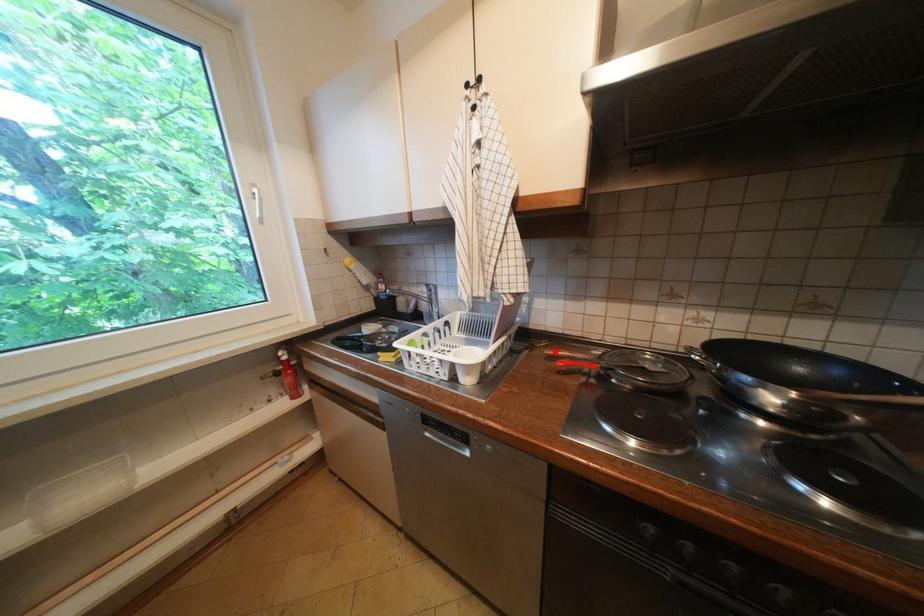
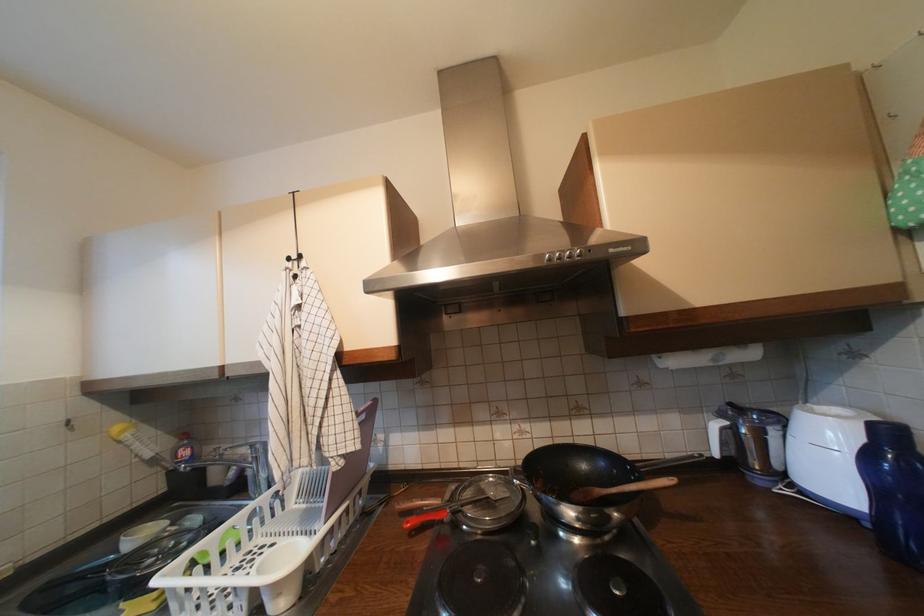
The point at the highlighted location is marked in the first image. Where is the corresponding point in the second image?

(407, 506)